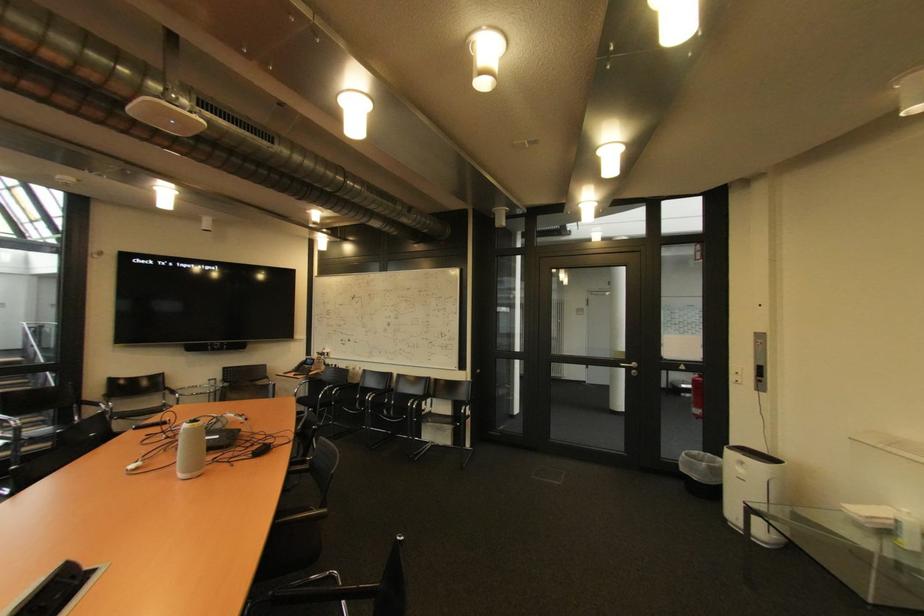
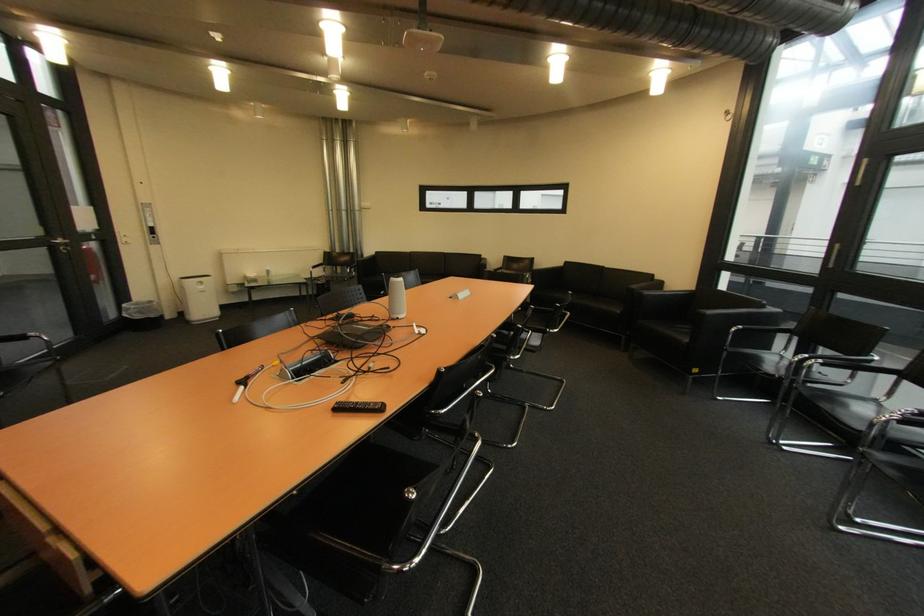
Question: I am providing you with two images of the same scene from different viewpoints. After the viewpoint changes to image2, which objects are now occluded?

Choices:
 (A) window handle
 (B) chair sitting surface
 (C) silver door handle
 (D) none of these

Answer: (D)